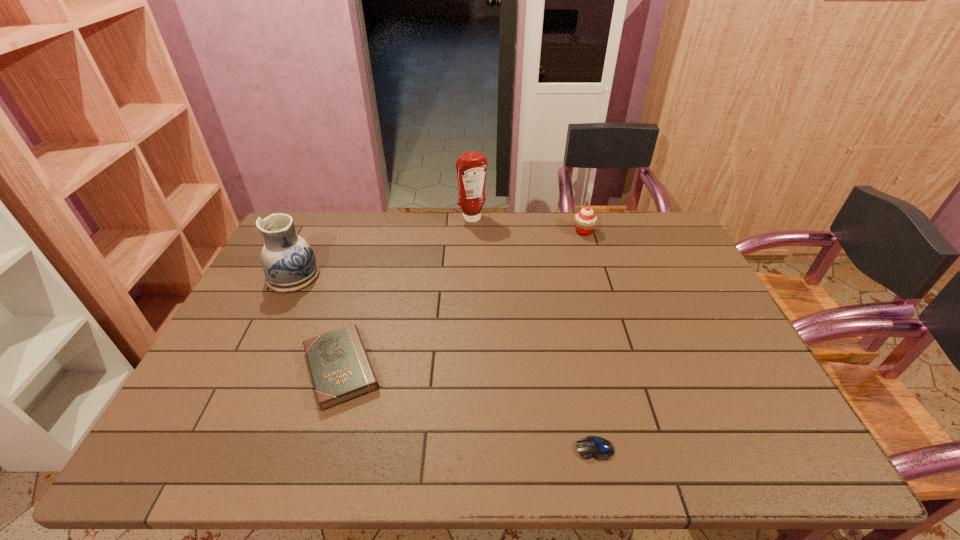
The image size is (960, 540). Find the location of `vacant region located 0.400m on the right of the third object from left to right`. vacant region located 0.400m on the right of the third object from left to right is located at coordinates (595, 219).

The height and width of the screenshot is (540, 960). What are the coordinates of `free region located 0.110m on the back of the pottery` in the screenshot? It's located at (311, 240).

The width and height of the screenshot is (960, 540). I want to click on vacant space situated 0.380m on the front of the third tallest object, so click(610, 317).

This screenshot has height=540, width=960. What are the coordinates of `free spot located on the front of the second object from left to right` in the screenshot? It's located at (322, 435).

You are a GUI agent. You are given a task and a screenshot of the screen. Output one action in this format:
    pyautogui.click(x=<x>, y=<y>)
    Task: Click on the vacant space located on the button side of the fourth object from left to right
    This screenshot has height=540, width=960.
    Given the screenshot: What is the action you would take?
    pyautogui.click(x=516, y=449)

Locate an element on the screen. This screenshot has width=960, height=540. free location located on the button side of the fourth object from left to right is located at coordinates (488, 449).

I want to click on vacant space situated 0.120m on the button side of the fourth object from left to right, so click(x=520, y=449).

Find the location of a particular element. Image resolution: width=960 pixels, height=540 pixels. condiment located in the far edge section of the desktop is located at coordinates (471, 167).

Where is `cupcake that is at the far edge`? This screenshot has width=960, height=540. cupcake that is at the far edge is located at coordinates (585, 221).

Where is `object located in the near edge section of the desktop`? The height and width of the screenshot is (540, 960). object located in the near edge section of the desktop is located at coordinates (599, 448).